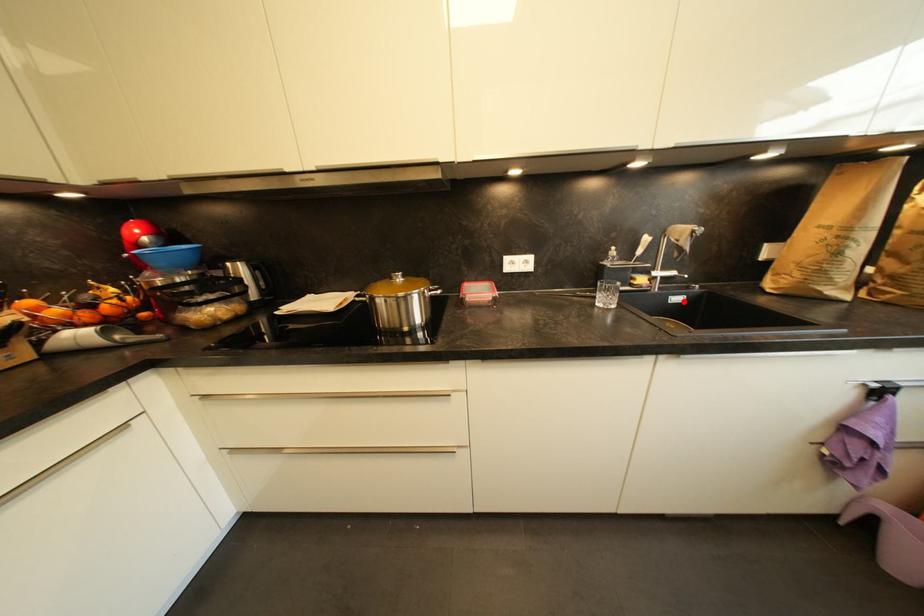
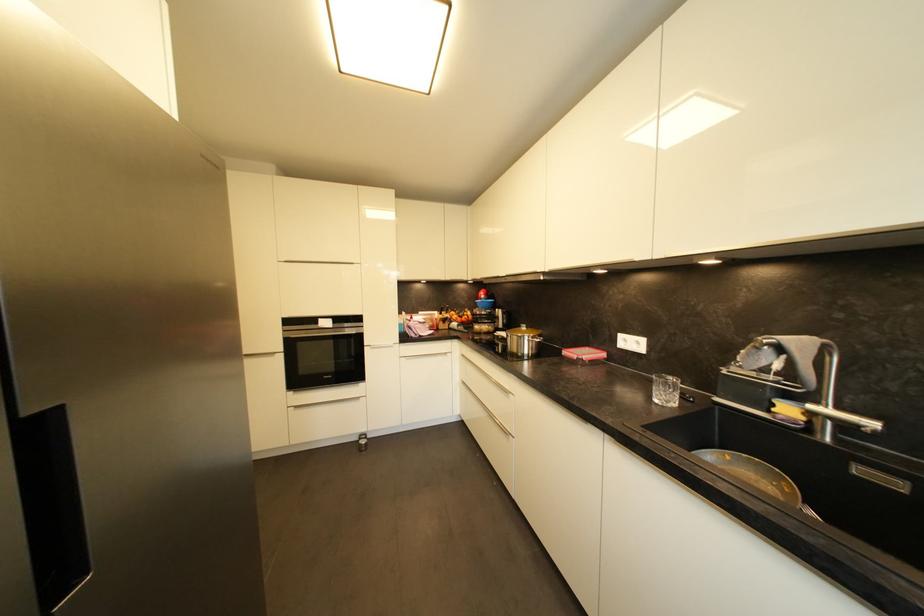
Where in the second image is the point corresponding to the highlighted location from the first image?

(904, 487)